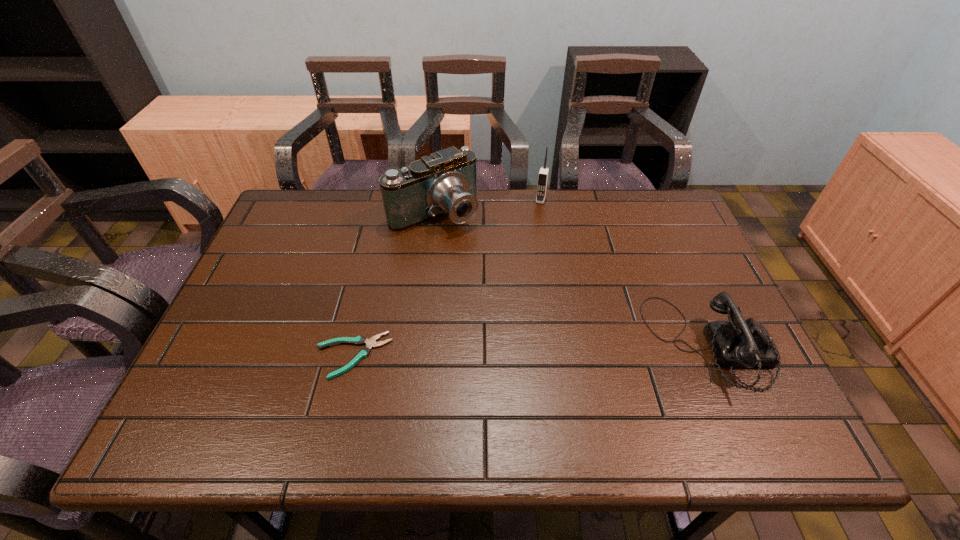
Image resolution: width=960 pixels, height=540 pixels. I want to click on free space located on the front-facing side of the cellular telephone, so click(x=518, y=280).

Where is `free space located on the front-facing side of the cellular telephone`? free space located on the front-facing side of the cellular telephone is located at coordinates (529, 242).

What are the coordinates of `camcorder that is positioned at the far edge` in the screenshot? It's located at (444, 183).

The height and width of the screenshot is (540, 960). I want to click on cellular telephone present at the far edge, so click(x=544, y=171).

The image size is (960, 540). What are the coordinates of `pliers located in the near edge section of the desktop` in the screenshot? It's located at (359, 340).

Find the location of a particular element. The width and height of the screenshot is (960, 540). telephone that is at the near edge is located at coordinates (738, 343).

The width and height of the screenshot is (960, 540). I want to click on object that is at the right edge, so click(x=738, y=343).

The width and height of the screenshot is (960, 540). In order to click on object at the near right corner in this screenshot , I will do (x=738, y=343).

What are the coordinates of `free location at the far edge of the desktop` in the screenshot? It's located at [x=578, y=197].

Where is `vacant space at the near edge`? Image resolution: width=960 pixels, height=540 pixels. vacant space at the near edge is located at coordinates (593, 370).